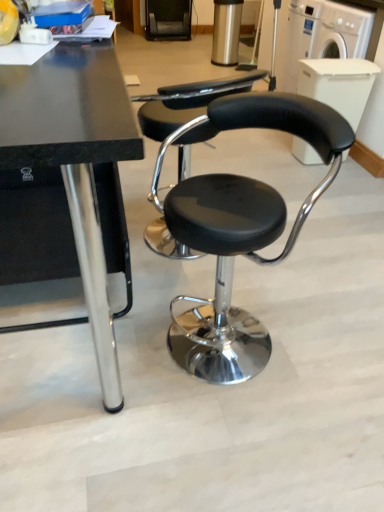
Question: Based on their positions, is black leather stool at center located to the left or right of white plastic washing machine at upper right, the 1th washing machine when ordered from top to bottom?

Choices:
 (A) left
 (B) right

Answer: (A)

Question: From the image's perspective, is black leather stool at center above or below white plastic washing machine at upper right, which appears as the second washing machine when ordered from the bottom?

Choices:
 (A) below
 (B) above

Answer: (A)

Question: Which object is positioned closest to the black polished wood table at center?

Choices:
 (A) white plastic washing machine at upper right, which is the 2th washing machine from top to bottom
 (B) black leather stool at center
 (C) white plastic washing machine at upper right, the 1th washing machine when ordered from top to bottom

Answer: (B)

Question: Estimate the real-world distances between objects in this image. Which object is farther from the black polished wood table at center?

Choices:
 (A) white plastic washing machine at upper right, which ranks as the first washing machine in bottom-to-top order
 (B) white plastic washing machine at upper right, the 1th washing machine when ordered from top to bottom
 (C) black leather stool at center

Answer: (A)